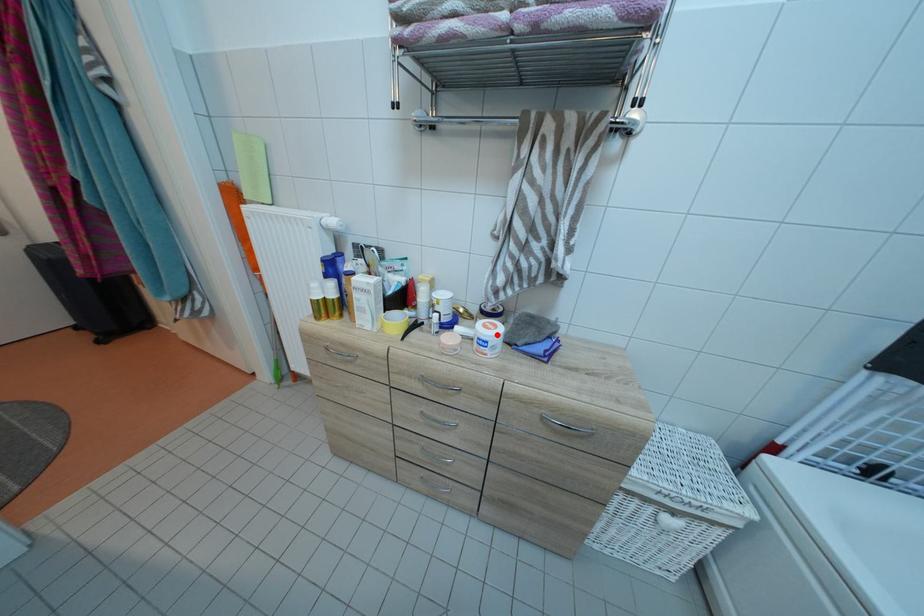
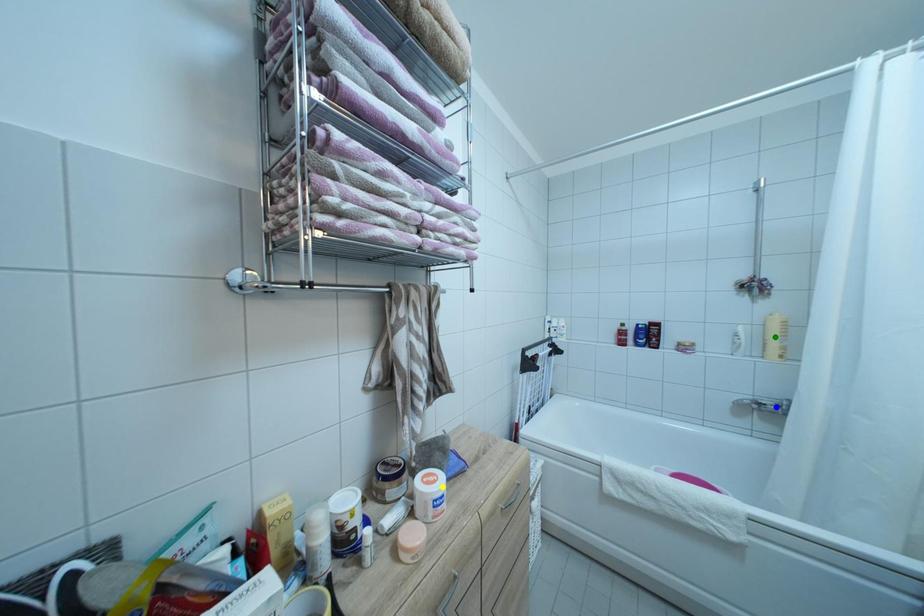
Question: I am providing you with two images of the same scene from different viewpoints. A red point is marked on the first image. You are given multiple points on the second image. In image 2, which mark is for the same physical point as the one in image 1?

Choices:
 (A) blue point
 (B) yellow point
 (C) green point

Answer: (B)